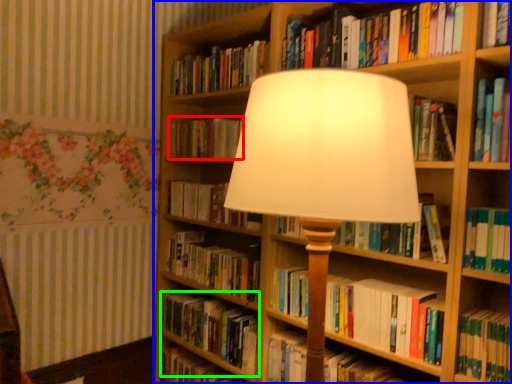
Question: Which object is positioned closest to book (highlighted by a red box)? Select from bookcase (highlighted by a blue box) and book (highlighted by a green box).

Choices:
 (A) bookcase
 (B) book

Answer: (A)